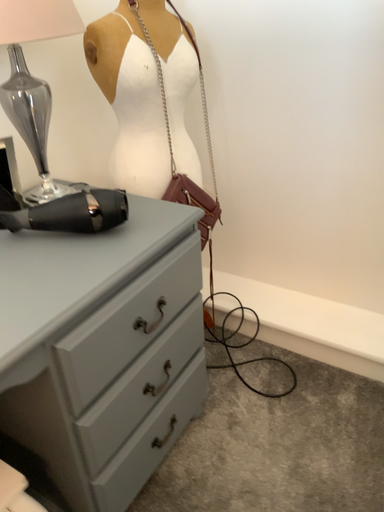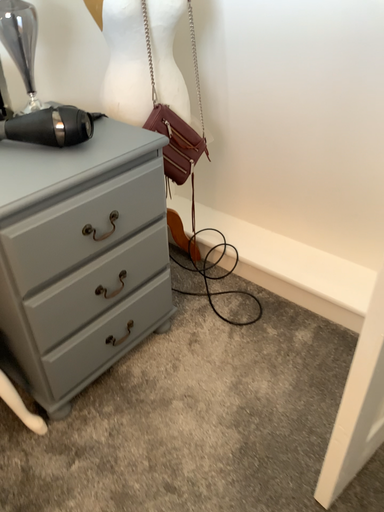
Question: How did the camera likely rotate when shooting the video?

Choices:
 (A) rotated left
 (B) rotated right

Answer: (A)